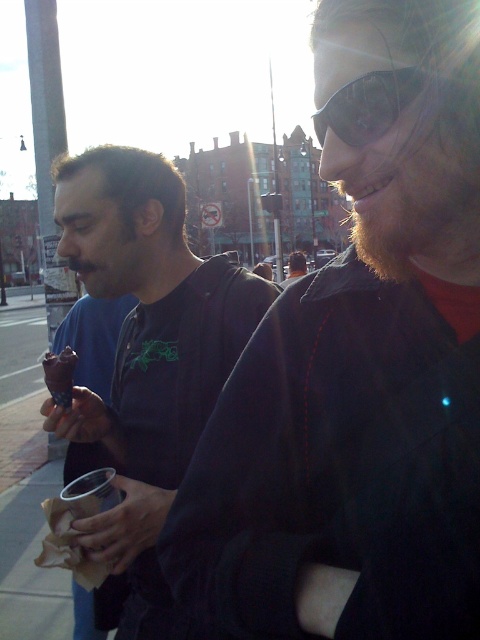
You are standing in the urban area shown and need to locate the sunglasses at upper right. According to the coordinates provided, where exactly would you find them?

The sunglasses at upper right are located at the coordinates point [369,106].

You are standing at the matte black jacket at center and want to throw a paper airplane to the sunglasses at upper right. Can you reach it with a single throw if the maximum distance you can throw is 8 meters?

The distance between the sunglasses at upper right and the matte black jacket at center is 7.91 meters. Since your maximum throw distance is 8 meters, you can reach the sunglasses at upper right with a single throw.